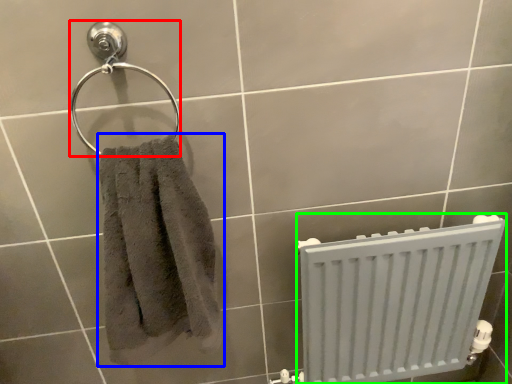
Question: Based on their relative distances, which object is nearer to towel bar (highlighted by a red box)? Choose from towel (highlighted by a blue box) and radiator (highlighted by a green box).

Choices:
 (A) towel
 (B) radiator

Answer: (A)